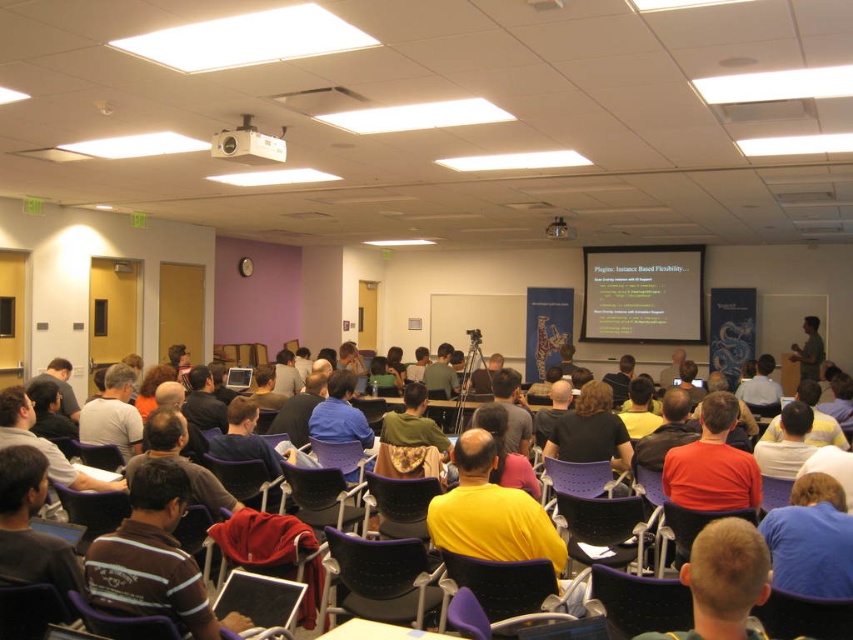
You are sitting in the lecture hall and want to take notes on your laptop. The screen of the white matte projection screen at upper center and the matte black laptop at center are both visible. Which device is positioned higher in the room?

The white matte projection screen at upper center is located above the matte black laptop at center, so it is positioned higher in the room.

You are sitting in the lecture hall and want to move to the front row. There are two points marked in the room. One is at point [653,280] and the other is at point [714,452]. Which point is closer to the front of the room?

Point [714,452] is closer to the front of the room because it is in front of point [653,280].

You are sitting in the lecture hall and need to adjust your view to see the white matte projection screen at upper center clearly. Considering the screen is positioned at coordinates approximately 0.459 on the horizontal axis and 0.754 on the vertical axis, where should you position yourself relative to the screen to ensure a clear view?

The white matte projection screen at upper center is located at point [642,292]. To ensure a clear view, you should position yourself directly in front of the screen, centered horizontally and at a distance that allows the vertical axis position to be within your line of sight. This means sitting in the central rows of the lecture hall, neither too far left nor right, and ensuring your line of sight aligns with the screen at approximately 0.754 on the vertical axis.